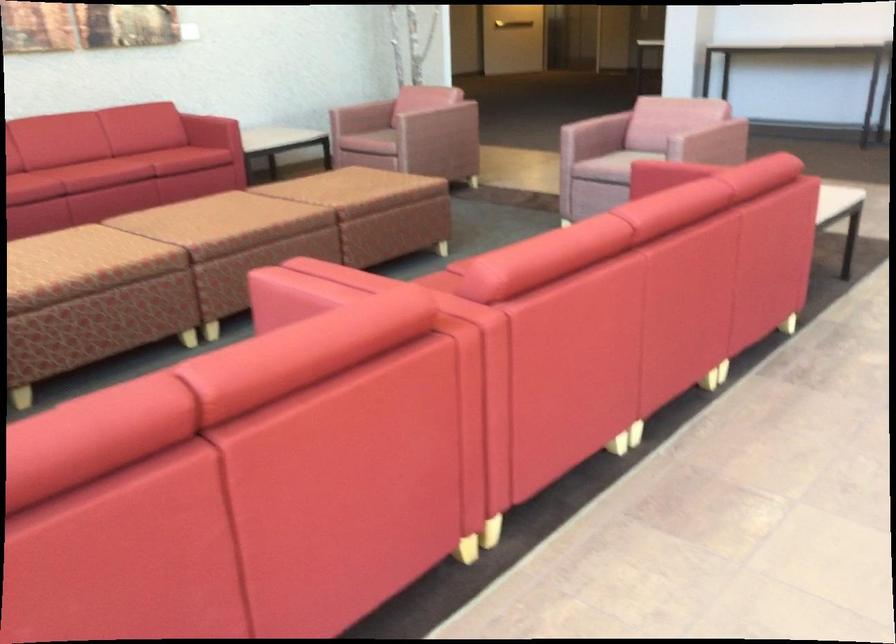
Identify the location of red sofa armrest. Image resolution: width=896 pixels, height=644 pixels. (112, 574).